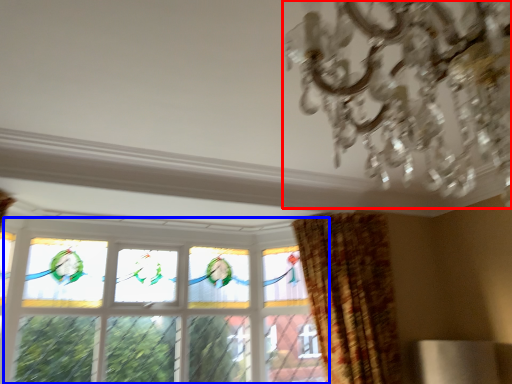
Question: Which point is closer to the camera, chandelier (highlighted by a red box) or window (highlighted by a blue box)?

Choices:
 (A) chandelier
 (B) window

Answer: (A)